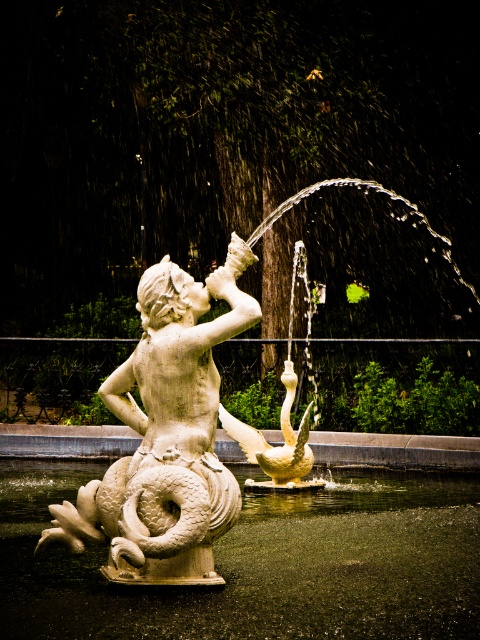
Consider the image. Who is more forward, (176, 545) or (214, 458)?

Point (176, 545) is in front.

Who is more distant from viewer, (168,428) or (214,291)?

Point (214,291)

Where is `white stone fountain at center`? The image size is (480, 640). white stone fountain at center is located at coordinates (183, 428).

Which of these two, white stone water at lower center or white stone mermaid at center, stands taller?

With more height is white stone mermaid at center.

Between point (280, 572) and point (160, 291), which one is positioned behind?

The point (280, 572) is more distant.

Where is `white stone water at lower center`? The height and width of the screenshot is (640, 480). white stone water at lower center is located at coordinates (261, 564).

The width and height of the screenshot is (480, 640). Find the location of `white stone water at lower center`. white stone water at lower center is located at coordinates (261, 564).

Which is above, white stone water at lower center or white stone fountain at center?

white stone fountain at center

Can you confirm if white stone water at lower center is positioned below white stone fountain at center?

Correct, white stone water at lower center is located below white stone fountain at center.

What do you see at coordinates (261, 564) in the screenshot? I see `white stone water at lower center` at bounding box center [261, 564].

The width and height of the screenshot is (480, 640). In order to click on white stone water at lower center in this screenshot , I will do [x=261, y=564].